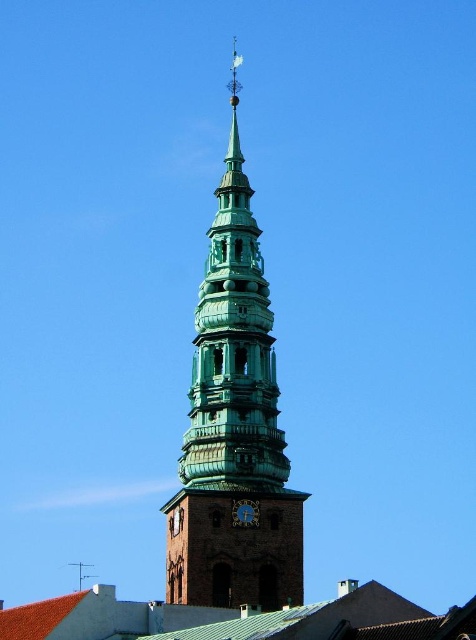
You are standing in front of the church tower and want to take a photo of both the green patinated metal tower at center and the blue metallic clock at center. Which object will appear larger in the photo?

The green patinated metal tower at center will appear larger in the photo because it is closer to the viewer than the blue metallic clock at center.

You are an architect analyzing the church tower. You need to determine if the green patinated metal tower at center can accommodate a new decorative element on its side. Given that the blue metallic clock at center is narrower than the tower, would the tower have enough space to add this element without overlapping the clock?

The green patinated metal tower at center is wider than the blue metallic clock at center, so there is sufficient space to add the decorative element without overlapping the clock.

You are standing at the base of the church tower and want to take a photo of the point at coordinates (202, 394). The camera you are using has a maximum focus range of 300 feet. Will the camera be able to focus on that point?

The point at coordinates (202, 394) is 344.13 feet away from the camera, which exceeds the maximum focus range of 300 feet. Therefore, the camera will not be able to focus on that point.